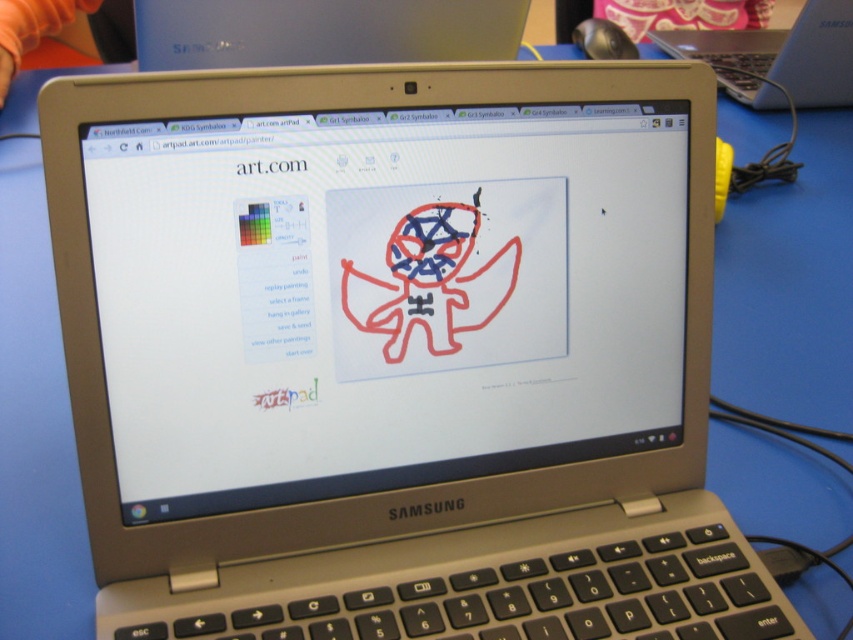
Question: Can you confirm if white glossy computer screen at center is positioned to the left of silver metallic laptop at upper center?

Choices:
 (A) no
 (B) yes

Answer: (B)

Question: Observing the image, what is the correct spatial positioning of white glossy computer screen at center in reference to silver metallic laptop at upper center?

Choices:
 (A) right
 (B) left

Answer: (B)

Question: Which of the following is the closest to the observer?

Choices:
 (A) silver metallic laptop at upper center
 (B) white glossy computer screen at center

Answer: (B)

Question: Is white glossy computer screen at center to the right of silver metallic laptop at upper center from the viewer's perspective?

Choices:
 (A) no
 (B) yes

Answer: (A)

Question: Which object is farther from the camera taking this photo?

Choices:
 (A) silver metallic laptop at upper center
 (B) white glossy computer screen at center

Answer: (A)

Question: Which point is farther to the camera?

Choices:
 (A) white glossy computer screen at center
 (B) silver metallic laptop at upper center

Answer: (B)